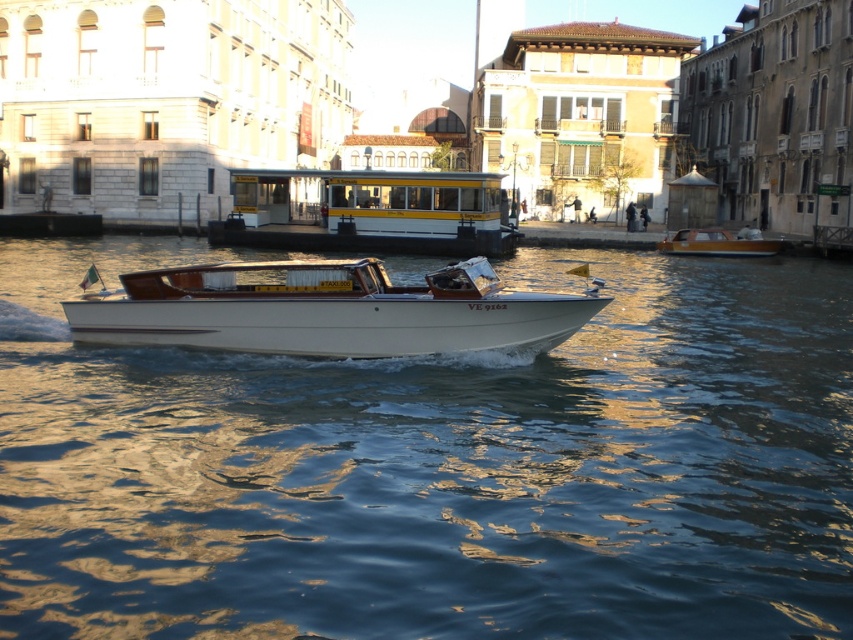
Can you confirm if yellow matte/tinted glass ferry at center is wider than wooden boat at center?

Yes.

Locate an element on the screen. yellow matte/tinted glass ferry at center is located at coordinates (368, 212).

Is point (827, 560) farther from camera compared to point (395, 221)?

No, (827, 560) is closer to viewer.

Does glossy water at center appear on the left side of yellow matte/tinted glass ferry at center?

In fact, glossy water at center is to the right of yellow matte/tinted glass ferry at center.

Does point (680, 552) come behind point (338, 227)?

That is False.

Identify the location of glossy water at center. (436, 465).

Who is taller, white polished wood boat at center or yellow matte/tinted glass ferry at center?

Standing taller between the two is yellow matte/tinted glass ferry at center.

Image resolution: width=853 pixels, height=640 pixels. What do you see at coordinates (326, 310) in the screenshot?
I see `white polished wood boat at center` at bounding box center [326, 310].

Image resolution: width=853 pixels, height=640 pixels. What are the coordinates of `white polished wood boat at center` in the screenshot? It's located at (326, 310).